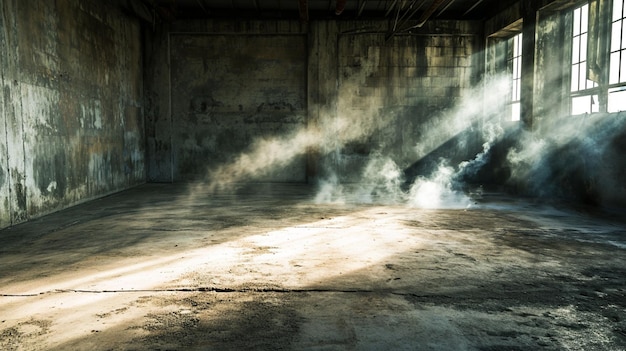
Where is `window`? The width and height of the screenshot is (626, 351). window is located at coordinates (519, 79), (583, 57), (621, 46).